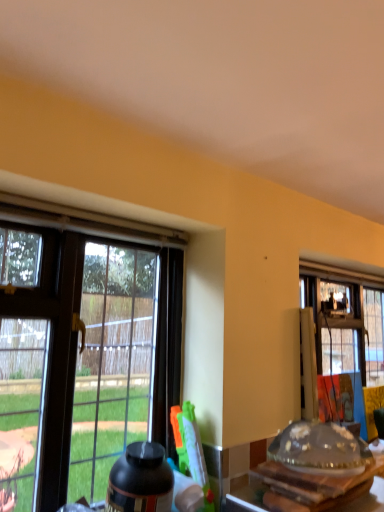
Question: From the image's perspective, would you say transparent glass table at lower right is shown under black matte bottle at lower center?

Choices:
 (A) yes
 (B) no

Answer: (B)

Question: Is transparent glass table at lower right wider than black matte bottle at lower center?

Choices:
 (A) no
 (B) yes

Answer: (B)

Question: Is transparent glass table at lower right with black matte bottle at lower center?

Choices:
 (A) no
 (B) yes

Answer: (A)

Question: Is black matte bottle at lower center inside transparent glass table at lower right?

Choices:
 (A) no
 (B) yes

Answer: (A)

Question: Is transparent glass table at lower right positioned before black matte bottle at lower center?

Choices:
 (A) yes
 (B) no

Answer: (A)

Question: From a real-world perspective, is transparent glass table at lower right physically below black matte bottle at lower center?

Choices:
 (A) yes
 (B) no

Answer: (B)

Question: Is black matte bottle at lower center positioned before transparent glass table at lower right?

Choices:
 (A) no
 (B) yes

Answer: (A)

Question: Is black matte bottle at lower center positioned with its back to transparent glass table at lower right?

Choices:
 (A) yes
 (B) no

Answer: (B)

Question: From a real-world perspective, is black matte bottle at lower center over transparent glass table at lower right?

Choices:
 (A) no
 (B) yes

Answer: (A)

Question: Is black matte bottle at lower center far away from transparent glass table at lower right?

Choices:
 (A) no
 (B) yes

Answer: (A)

Question: From a real-world perspective, is black matte bottle at lower center positioned under transparent glass table at lower right based on gravity?

Choices:
 (A) no
 (B) yes

Answer: (B)

Question: Can you confirm if black matte bottle at lower center is positioned to the left of transparent glass table at lower right?

Choices:
 (A) yes
 (B) no

Answer: (A)

Question: Can you confirm if transparent glass window at left is taller than transparent glass table at lower right?

Choices:
 (A) yes
 (B) no

Answer: (A)